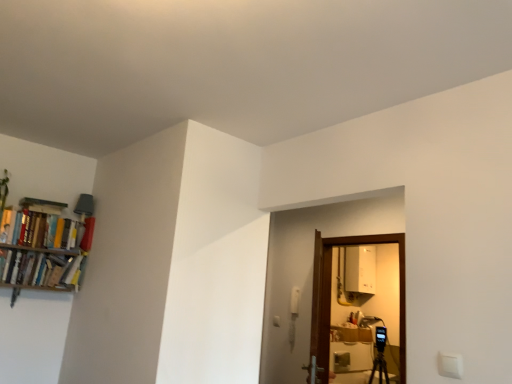
Question: From the image's perspective, is matte red book at upper left, which is counted as the 2th book, starting from the top, located beneath hardcover books at left, which appears as the third book when viewed from the top?

Choices:
 (A) yes
 (B) no

Answer: (B)

Question: Is matte red book at upper left, which appears as the second book when ordered from the bottom, thinner than hardcover books at left, which is the 1th book in bottom-to-top order?

Choices:
 (A) yes
 (B) no

Answer: (A)

Question: From the image's perspective, does matte red book at upper left, which is counted as the 2th book, starting from the top, appear higher than hardcover books at left, which appears as the third book when viewed from the top?

Choices:
 (A) yes
 (B) no

Answer: (A)

Question: Is matte red book at upper left, which is counted as the 2th book, starting from the top, looking in the opposite direction of hardcover books at left, which is the 1th book in bottom-to-top order?

Choices:
 (A) no
 (B) yes

Answer: (A)

Question: Is matte red book at upper left, which is counted as the 2th book, starting from the top, positioned behind hardcover books at left, which is the 1th book in bottom-to-top order?

Choices:
 (A) yes
 (B) no

Answer: (A)

Question: Is matte red book at upper left, which appears as the second book when ordered from the bottom, beside hardcover books at left, which appears as the third book when viewed from the top?

Choices:
 (A) yes
 (B) no

Answer: (B)

Question: From the image's perspective, is matte red book at upper left, which is counted as the 2th book, starting from the top, on top of hardcover books at left, which is the 1th book from top to bottom?

Choices:
 (A) yes
 (B) no

Answer: (B)

Question: Could you tell me if matte red book at upper left, which appears as the second book when ordered from the bottom, is facing hardcover books at left, which is the 1th book from top to bottom?

Choices:
 (A) no
 (B) yes

Answer: (A)

Question: Does matte red book at upper left, which is counted as the 2th book, starting from the top, lie behind hardcover books at left, which is the 1th book from top to bottom?

Choices:
 (A) no
 (B) yes

Answer: (B)

Question: Does matte red book at upper left, which is counted as the 2th book, starting from the top, have a smaller size compared to hardcover books at left, which is the 1th book from top to bottom?

Choices:
 (A) no
 (B) yes

Answer: (B)

Question: Is the surface of matte red book at upper left, which appears as the second book when ordered from the bottom, in direct contact with hardcover books at left, which is the 1th book from top to bottom?

Choices:
 (A) yes
 (B) no

Answer: (B)

Question: Does matte red book at upper left, which appears as the second book when ordered from the bottom, have a greater height compared to hardcover books at left, which is the 1th book from top to bottom?

Choices:
 (A) yes
 (B) no

Answer: (B)

Question: Is hardcover books at left, which is the 1th book in bottom-to-top order, not near matte red book at upper left, which appears as the second book when ordered from the bottom?

Choices:
 (A) yes
 (B) no

Answer: (B)